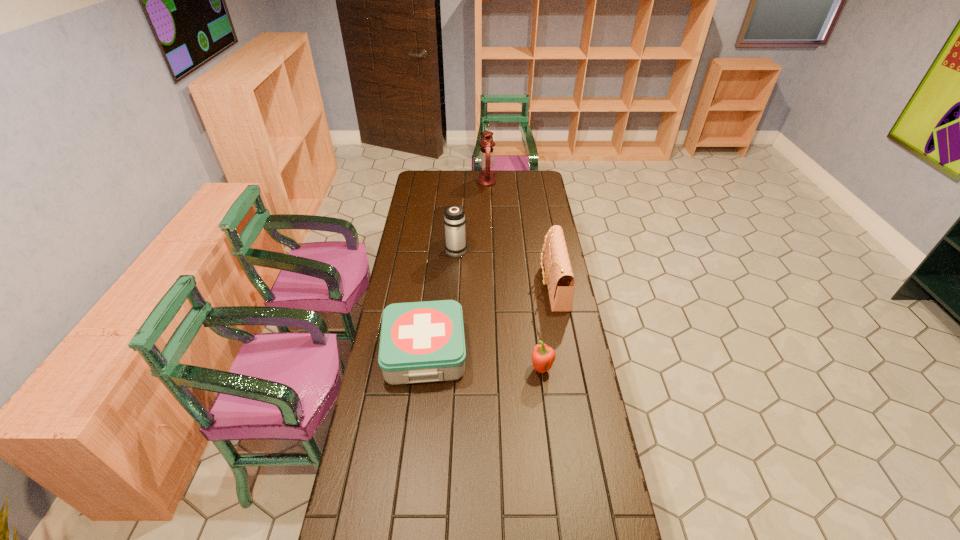
Identify which object is the second nearest to the third object from left to right. Please provide its 2D coordinates. Your answer should be formatted as a tuple, i.e. [(x, y)], where the tuple contains the x and y coordinates of a point satisfying the conditions above.

[(559, 278)]

Choose which object is the fourth nearest neighbor to the tallest object. Please provide its 2D coordinates. Your answer should be formatted as a tuple, i.e. [(x, y)], where the tuple contains the x and y coordinates of a point satisfying the conditions above.

[(543, 356)]

The width and height of the screenshot is (960, 540). I want to click on vacant area in the image that satisfies the following two spatial constraints: 1. on the back side of the farthest object; 2. on the left side of the first-aid kit, so click(x=444, y=182).

Locate an element on the screen. The image size is (960, 540). vacant point that satisfies the following two spatial constraints: 1. on the back side of the tallest object; 2. on the right side of the first-aid kit is located at coordinates (444, 182).

Image resolution: width=960 pixels, height=540 pixels. In order to click on vacant space that satisfies the following two spatial constraints: 1. on the front side of the first-aid kit; 2. on the left side of the pepper in this screenshot , I will do `click(423, 370)`.